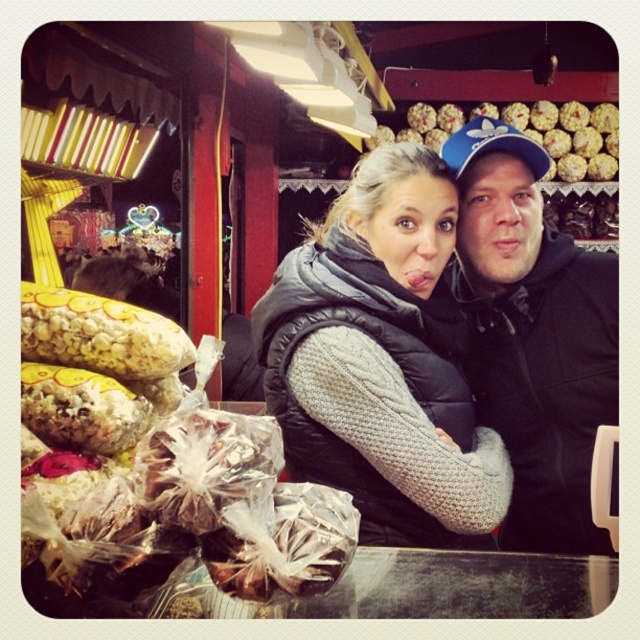
You are standing in front of the market stall and want to find the black hoodie at center. Where should you look relative to the table?

The black hoodie at center is located at the 2D coordinates point (532, 336) relative to the table.

You are a customer at the market stall and want to buy both the gray quilted vest at center and the shiny metallic popcorn at left. Which item is closer to you?

The shiny metallic popcorn at left is closer to you because the gray quilted vest at center is located above it, meaning the popcorn is positioned lower and nearer in the scene.

You are standing at the market stall and want to know which of the two points, point (509, 371) or point (440, 147), is closer to you. Based on the scene description, which point is nearer?

Point (509, 371) is closer to the viewer than point (440, 147).